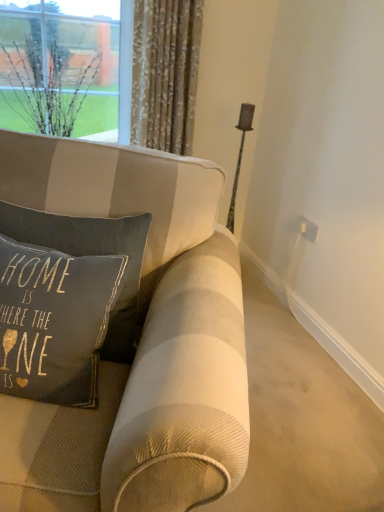
Question: From the image's perspective, is white plastic electric outlet at upper right on floral fabric curtain at upper center?

Choices:
 (A) no
 (B) yes

Answer: (A)

Question: Considering the relative positions of white plastic electric outlet at upper right and floral fabric curtain at upper center in the image provided, is white plastic electric outlet at upper right to the right of floral fabric curtain at upper center from the viewer's perspective?

Choices:
 (A) no
 (B) yes

Answer: (B)

Question: Is white plastic electric outlet at upper right beside floral fabric curtain at upper center?

Choices:
 (A) no
 (B) yes

Answer: (A)

Question: Is the position of white plastic electric outlet at upper right less distant than that of floral fabric curtain at upper center?

Choices:
 (A) yes
 (B) no

Answer: (B)

Question: Are white plastic electric outlet at upper right and floral fabric curtain at upper center located far from each other?

Choices:
 (A) no
 (B) yes

Answer: (A)

Question: Is white plastic electric outlet at upper right oriented towards floral fabric curtain at upper center?

Choices:
 (A) yes
 (B) no

Answer: (B)

Question: Does dark gray fabric pillow at center have a lesser width compared to clear glass vase at upper left?

Choices:
 (A) no
 (B) yes

Answer: (B)

Question: Can you confirm if dark gray fabric pillow at center is smaller than clear glass vase at upper left?

Choices:
 (A) no
 (B) yes

Answer: (B)

Question: From a real-world perspective, is dark gray fabric pillow at center below clear glass vase at upper left?

Choices:
 (A) no
 (B) yes

Answer: (B)

Question: Would you say clear glass vase at upper left is part of dark gray fabric pillow at center's contents?

Choices:
 (A) no
 (B) yes

Answer: (A)

Question: Is dark gray fabric pillow at center looking in the opposite direction of clear glass vase at upper left?

Choices:
 (A) no
 (B) yes

Answer: (B)

Question: Can you confirm if dark gray fabric pillow at center is taller than clear glass vase at upper left?

Choices:
 (A) yes
 (B) no

Answer: (B)

Question: Does floral fabric curtain at upper center have a greater width compared to dark gray fabric pillow at center?

Choices:
 (A) yes
 (B) no

Answer: (B)